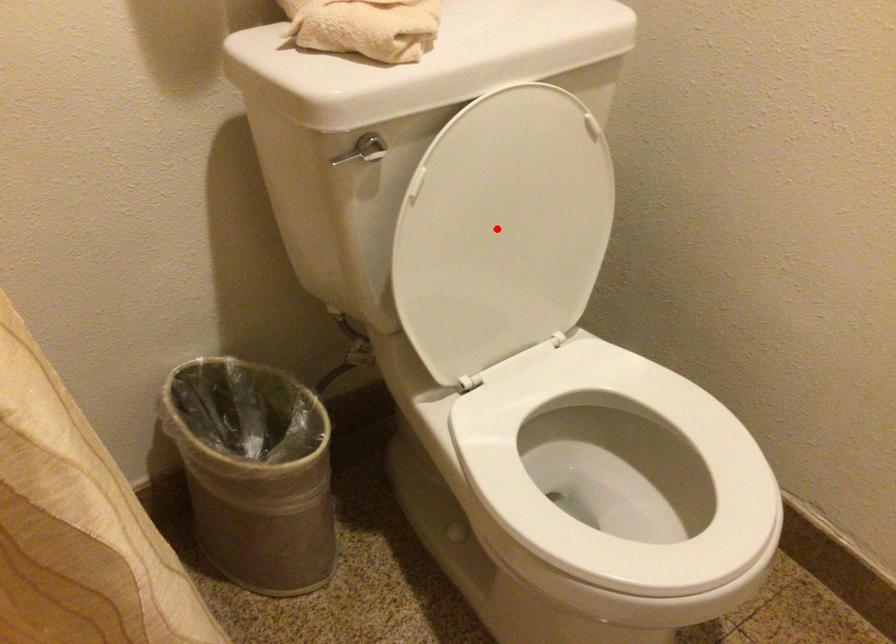
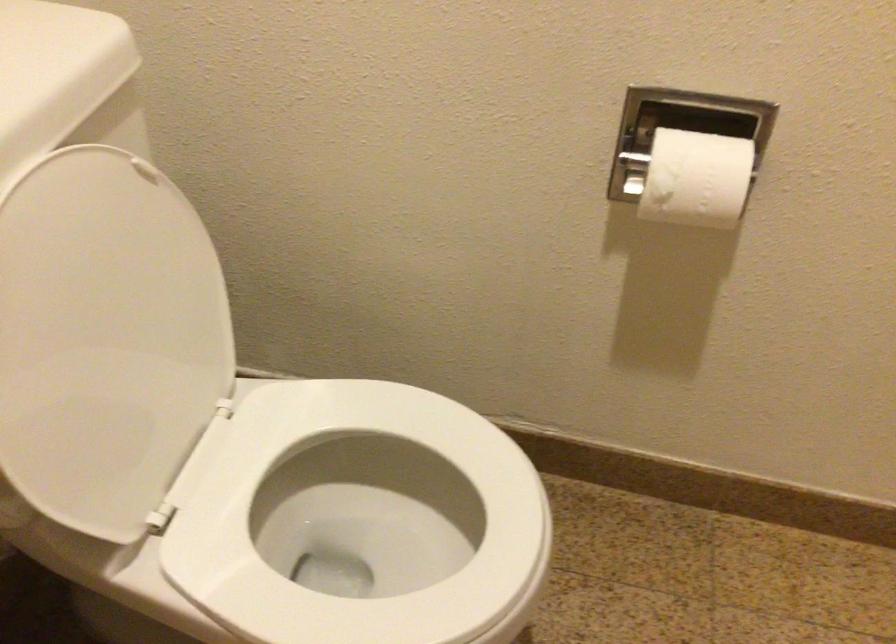
Question: I am providing you with two images of the same scene from different viewpoints. Given a red point in image1, look at the same physical point in image2. Is it:

Choices:
 (A) Closer to the viewpoint
 (B) Farther from the viewpoint

Answer: (A)